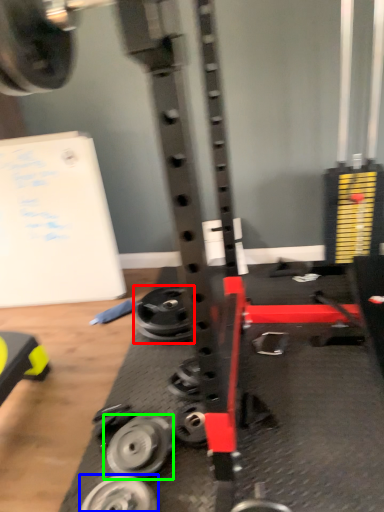
Question: Based on their relative distances, which object is farther from wheel (highlighted by a red box)? Choose from wheel (highlighted by a blue box) and wheel (highlighted by a green box).

Choices:
 (A) wheel
 (B) wheel

Answer: (A)